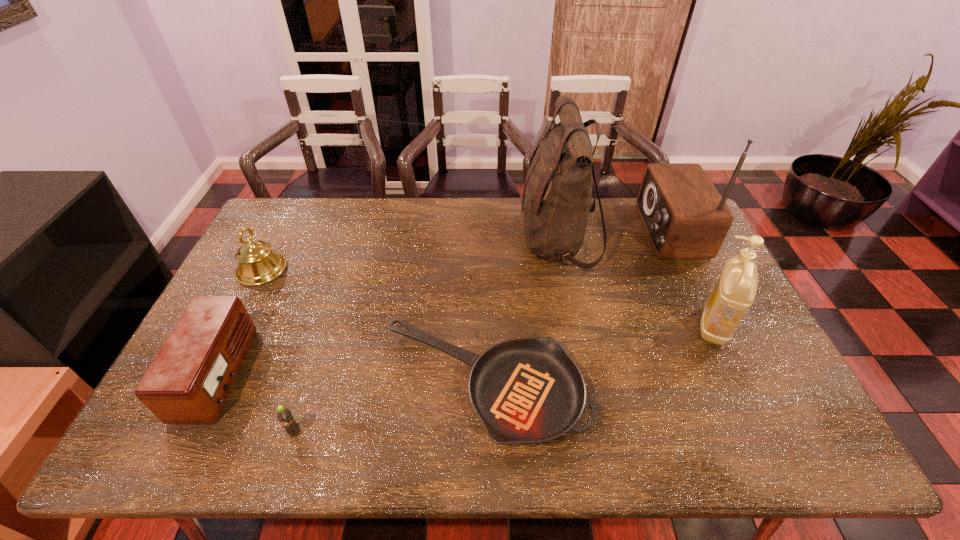
I want to click on object that is at the far right corner, so click(685, 217).

In the image, there is a desktop. Where is `vacant space at the far edge`? This screenshot has height=540, width=960. vacant space at the far edge is located at coordinates (514, 216).

In the image, there is a desktop. Identify the location of vacant space at the near edge. (508, 446).

In the image, there is a desktop. Identify the location of vacant region at the left edge. The height and width of the screenshot is (540, 960). (241, 289).

Find the location of a particular element. This screenshot has width=960, height=540. free region at the right edge of the desktop is located at coordinates (724, 350).

Identify the location of unoccupied area between the sixth tallest object and the taller radio receiver. This screenshot has height=540, width=960. (482, 331).

Identify the location of blank region between the third tallest object and the fourth shortest object. The height and width of the screenshot is (540, 960). (488, 298).

Where is `free area in between the shortest object and the farther radio receiver`? This screenshot has width=960, height=540. free area in between the shortest object and the farther radio receiver is located at coordinates (577, 307).

Find the location of a particular element. The image size is (960, 540). vacant space in between the backpack and the fourth shortest object is located at coordinates (410, 255).

Locate an element on the screen. Image resolution: width=960 pixels, height=540 pixels. vacant area that lies between the soda and the frying pan is located at coordinates (390, 408).